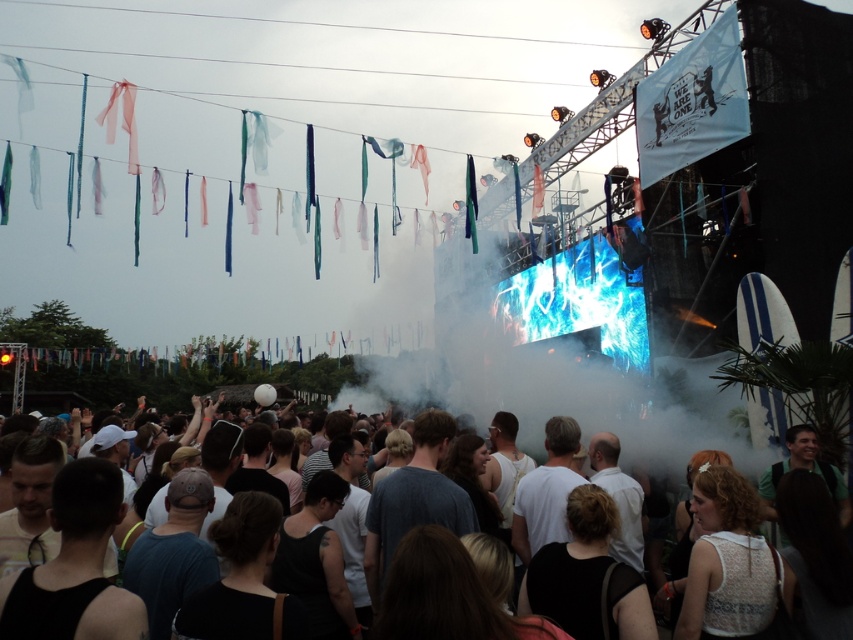
Is the position of white fog at center less distant than that of dark gray cotton crowd at lower center?

No, it is not.

Is white fog at center to the right of dark gray cotton crowd at lower center from the viewer's perspective?

No, white fog at center is not to the right of dark gray cotton crowd at lower center.

Between point (538, 387) and point (614, 440), which one is positioned in front?

Point (614, 440) is more forward.

I want to click on white fog at center, so click(x=589, y=362).